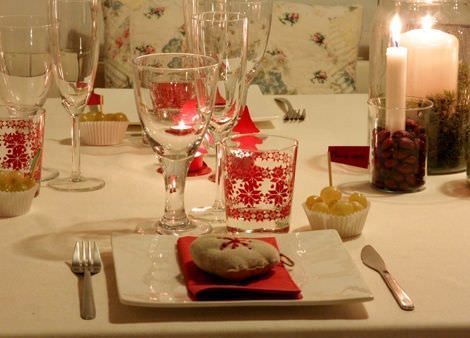
You are a GUI agent. You are given a task and a screenshot of the screen. Output one action in this format:
    pyautogui.click(x=<x>, y=<y>)
    Task: Click on the drinking glasses
    This screenshot has height=338, width=470.
    Given the screenshot: What is the action you would take?
    pyautogui.click(x=259, y=21), pyautogui.click(x=230, y=46), pyautogui.click(x=171, y=98), pyautogui.click(x=75, y=65), pyautogui.click(x=30, y=64), pyautogui.click(x=254, y=172)